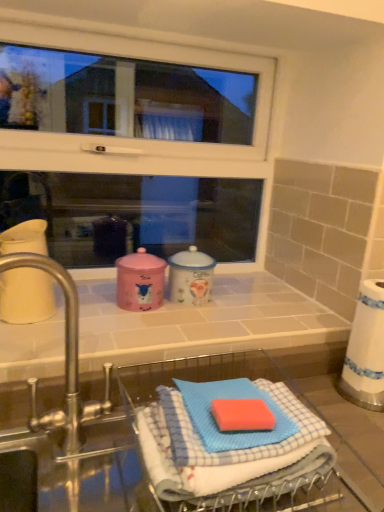
Question: Is white glossy window at upper center oriented away from blue checkered cloth at lower center?

Choices:
 (A) yes
 (B) no

Answer: (B)

Question: Does white glossy window at upper center have a greater width compared to blue checkered cloth at lower center?

Choices:
 (A) yes
 (B) no

Answer: (B)

Question: From the image's perspective, does white glossy window at upper center appear higher than blue checkered cloth at lower center?

Choices:
 (A) no
 (B) yes

Answer: (B)

Question: Considering the relative sizes of white glossy window at upper center and blue checkered cloth at lower center in the image provided, is white glossy window at upper center bigger than blue checkered cloth at lower center?

Choices:
 (A) no
 (B) yes

Answer: (B)

Question: Is white glossy window at upper center placed right next to blue checkered cloth at lower center?

Choices:
 (A) yes
 (B) no

Answer: (B)

Question: Considering the positions of white glossy counter top at center and blue checkered cloth at lower center in the image, is white glossy counter top at center wider or thinner than blue checkered cloth at lower center?

Choices:
 (A) thin
 (B) wide

Answer: (B)

Question: Considering the positions of white glossy counter top at center and blue checkered cloth at lower center in the image, is white glossy counter top at center bigger or smaller than blue checkered cloth at lower center?

Choices:
 (A) small
 (B) big

Answer: (B)

Question: From a real-world perspective, is white glossy counter top at center above or below blue checkered cloth at lower center?

Choices:
 (A) above
 (B) below

Answer: (A)

Question: Do you think white glossy counter top at center is within blue checkered cloth at lower center, or outside of it?

Choices:
 (A) outside
 (B) inside

Answer: (A)

Question: Considering the positions of white glossy counter top at center and white glossy window at upper center in the image, is white glossy counter top at center bigger or smaller than white glossy window at upper center?

Choices:
 (A) big
 (B) small

Answer: (B)

Question: From a real-world perspective, is white glossy counter top at center physically located above or below white glossy window at upper center?

Choices:
 (A) below
 (B) above

Answer: (A)

Question: Do you think white glossy counter top at center is within white glossy window at upper center, or outside of it?

Choices:
 (A) inside
 (B) outside

Answer: (B)

Question: Is white glossy counter top at center in front of or behind white glossy window at upper center in the image?

Choices:
 (A) front
 (B) behind

Answer: (A)

Question: From their relative heights in the image, would you say silver metallic tap at left is taller or shorter than blue checkered cloth at lower center?

Choices:
 (A) short
 (B) tall

Answer: (B)

Question: Considering the positions of point (49, 261) and point (258, 462), is point (49, 261) closer or farther from the camera than point (258, 462)?

Choices:
 (A) farther
 (B) closer

Answer: (A)